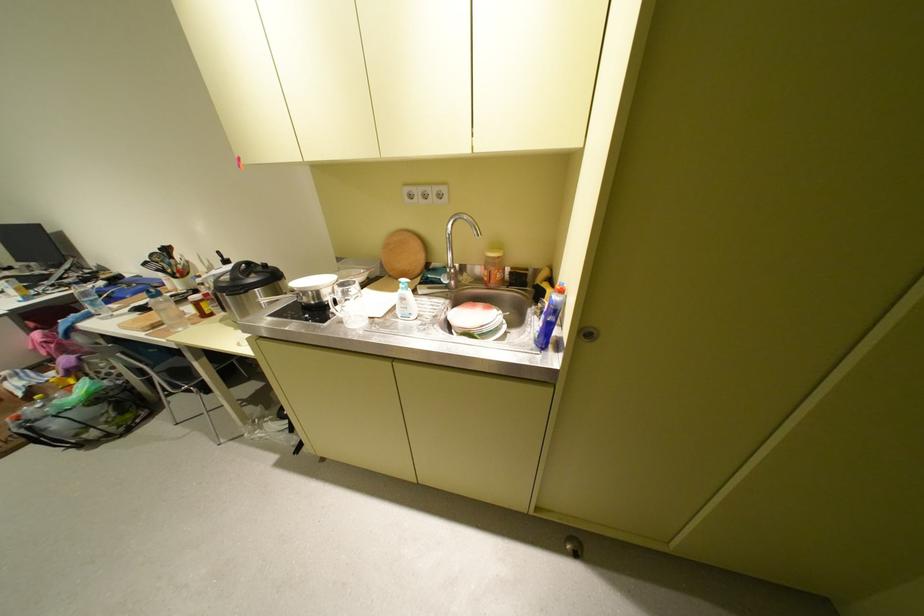
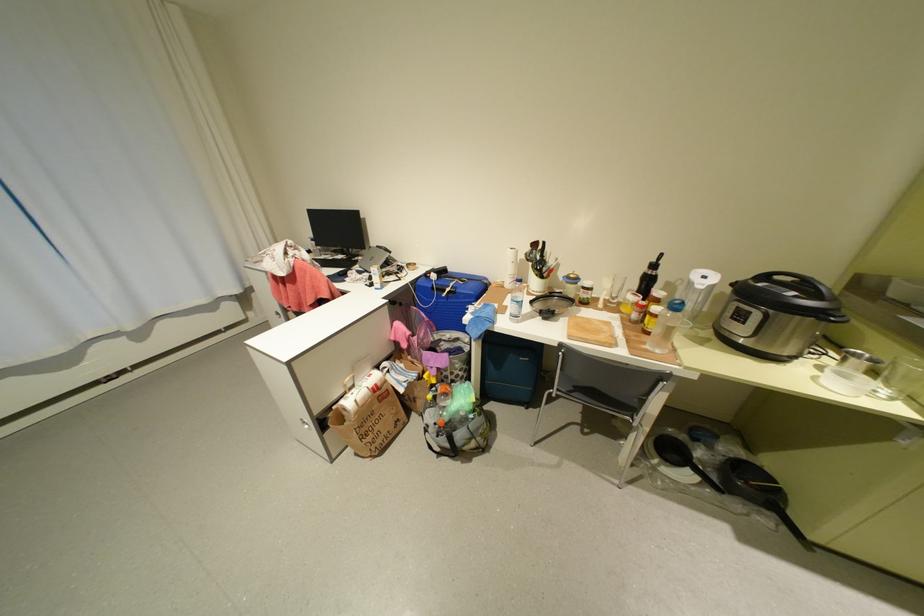
Find the pixel in the second image that matches point 114,284 in the first image.

(444, 276)